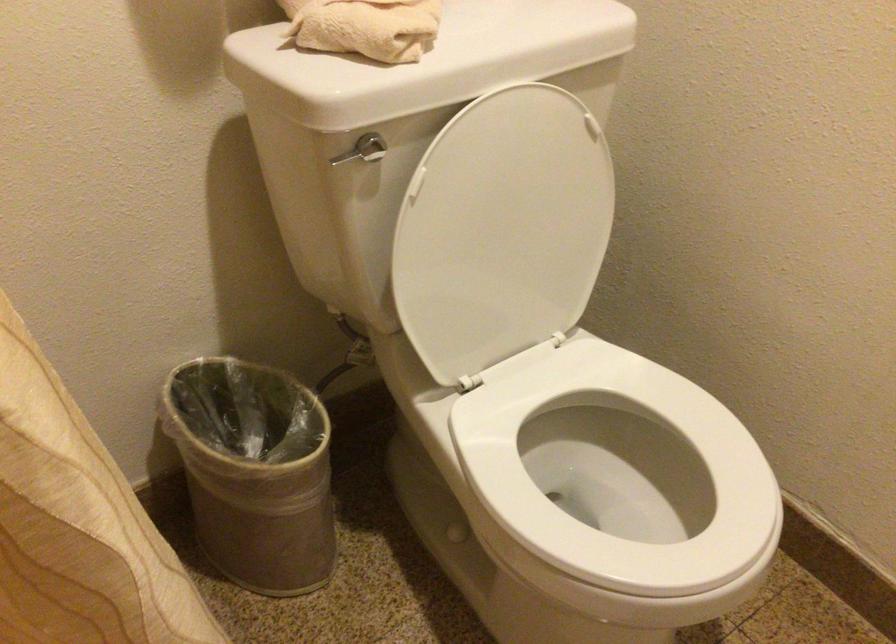
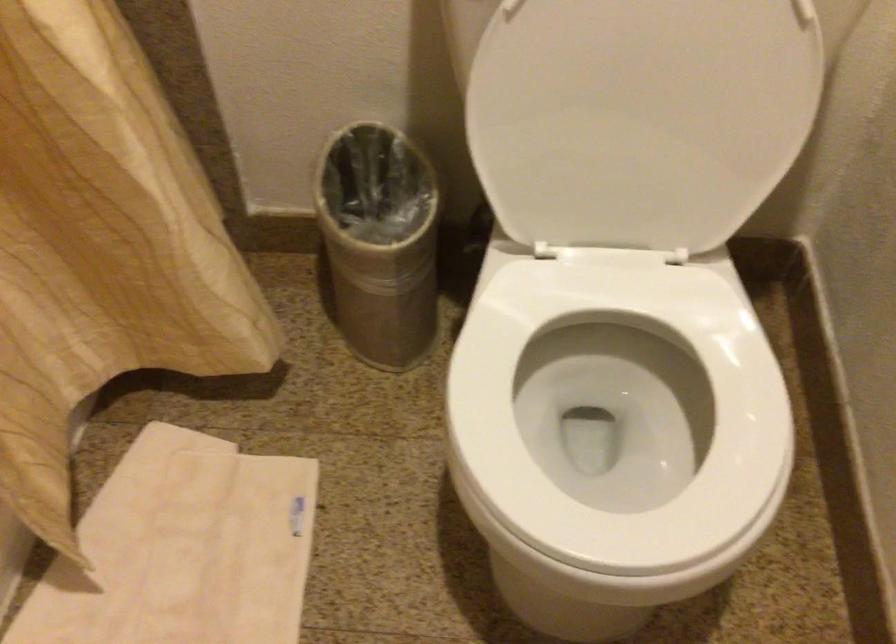
The point at (x=512, y=243) is marked in the first image. Where is the corresponding point in the second image?

(640, 118)